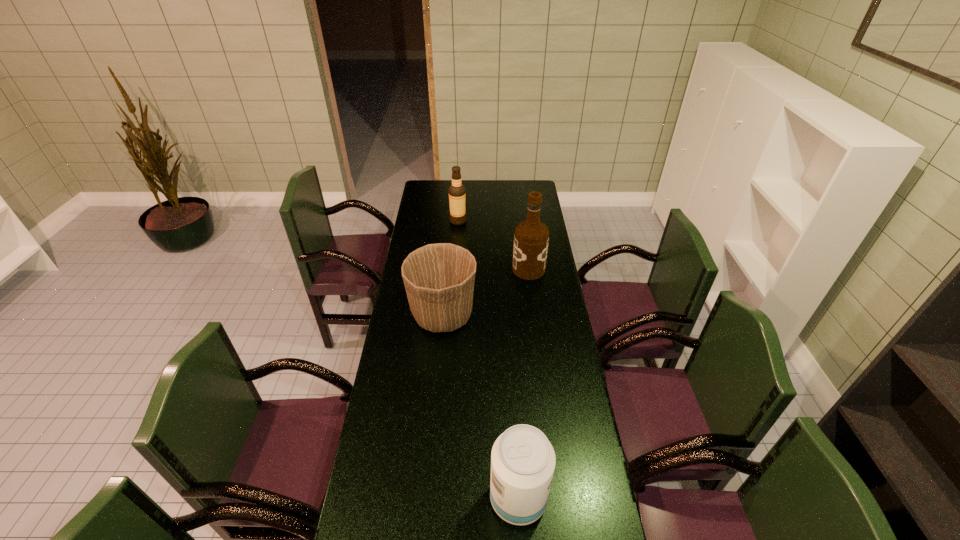
Locate an element on the screen. vacant space positioned on the right of the nearest alcohol is located at coordinates (587, 498).

Locate an element on the screen. vacant space located on the front of the second nearest object is located at coordinates (440, 352).

I want to click on object located at the left edge, so click(x=439, y=278).

The width and height of the screenshot is (960, 540). What are the coordinates of `object that is positioned at the right edge` in the screenshot? It's located at (531, 237).

The image size is (960, 540). I want to click on vacant area at the far edge, so click(x=506, y=200).

The width and height of the screenshot is (960, 540). In the image, there is a desktop. Identify the location of vacant region at the left edge. (418, 375).

The image size is (960, 540). I want to click on vacant space at the right edge, so click(x=564, y=314).

In order to click on blank region between the tallest object and the nearest alcohol in this screenshot , I will do `click(523, 384)`.

You are a GUI agent. You are given a task and a screenshot of the screen. Output one action in this format:
    pyautogui.click(x=<x>, y=<y>)
    Task: Click on the free space between the farthest object and the second farthest object
    Image resolution: width=960 pixels, height=540 pixels.
    Given the screenshot: What is the action you would take?
    pyautogui.click(x=493, y=245)

Where is `empty space between the second farthest object and the nearest object`? This screenshot has width=960, height=540. empty space between the second farthest object and the nearest object is located at coordinates (523, 384).